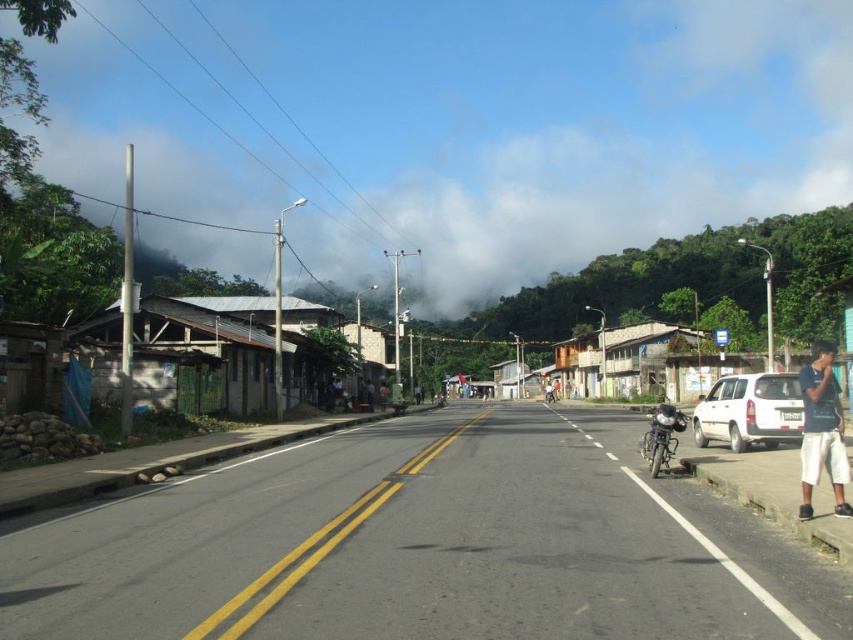
Between point (785, 403) and point (643, 442), which one is positioned behind?

The point (785, 403) is behind.

Is white matte suv at right to the left of shiny metallic motorcycle at center-right from the viewer's perspective?

In fact, white matte suv at right is to the right of shiny metallic motorcycle at center-right.

Image resolution: width=853 pixels, height=640 pixels. What are the coordinates of `white matte suv at right` in the screenshot? It's located at (749, 410).

Measure the distance from white matte suv at right to white cotton shorts at lower right.

white matte suv at right and white cotton shorts at lower right are 11.94 feet apart from each other.

Between white matte suv at right and white cotton shorts at lower right, which one has more height?

Standing taller between the two is white matte suv at right.

Is point (720, 432) closer to camera compared to point (815, 449)?

No.

Image resolution: width=853 pixels, height=640 pixels. Identify the location of white matte suv at right. (749, 410).

You are a GUI agent. You are given a task and a screenshot of the screen. Output one action in this format:
    pyautogui.click(x=<x>, y=<y>)
    Task: Click on the white cotton shorts at lower right
    The height and width of the screenshot is (640, 853).
    Given the screenshot: What is the action you would take?
    pyautogui.click(x=822, y=429)

Does white cotton shorts at lower right appear on the left side of shiny metallic motorcycle at center-right?

In fact, white cotton shorts at lower right is to the right of shiny metallic motorcycle at center-right.

Does point (805, 452) come behind point (670, 442)?

No, (805, 452) is closer to viewer.

Image resolution: width=853 pixels, height=640 pixels. Identify the location of white cotton shorts at lower right. (822, 429).